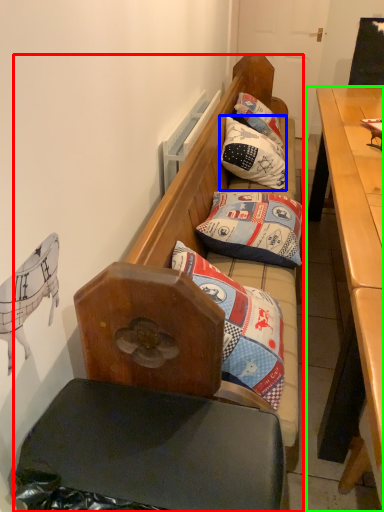
Question: Estimate the real-world distances between objects in this image. Which object is closer to studio couch (highlighted by a red box), pillow (highlighted by a blue box) or desk (highlighted by a green box)?

Choices:
 (A) pillow
 (B) desk

Answer: (B)